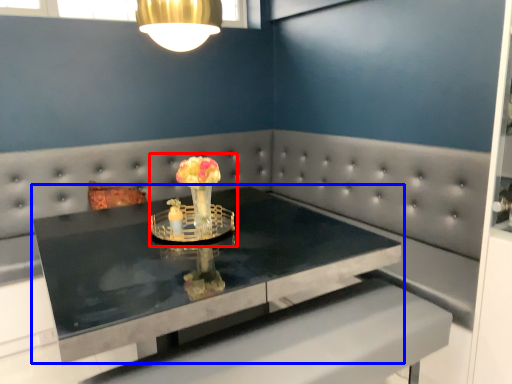
Question: Which of the following is the farthest to the observer, floral arrangement (highlighted by a red box) or table (highlighted by a blue box)?

Choices:
 (A) floral arrangement
 (B) table

Answer: (A)